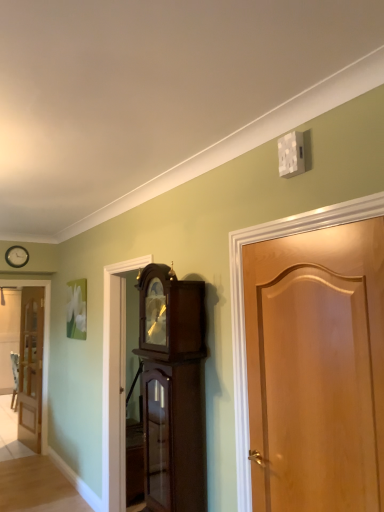
Question: Does light brown wooden door at left, the 2th door positioned from the right, have a smaller size compared to dark wood grandfather clock at center?

Choices:
 (A) no
 (B) yes

Answer: (B)

Question: Does light brown wooden door at left, placed as the 1th door when sorted from back to front, lie behind dark wood grandfather clock at center?

Choices:
 (A) no
 (B) yes

Answer: (B)

Question: Does light brown wooden door at left, placed as the 1th door when sorted from back to front, have a larger size compared to dark wood grandfather clock at center?

Choices:
 (A) no
 (B) yes

Answer: (A)

Question: Is dark wood grandfather clock at center located within light brown wooden door at left, the 2th door positioned from the right?

Choices:
 (A) no
 (B) yes

Answer: (A)

Question: Is light brown wooden door at left, the 2th door positioned from the right, positioned with its back to dark wood grandfather clock at center?

Choices:
 (A) no
 (B) yes

Answer: (A)

Question: Is light brown wooden door at left, the first door positioned from the left, taller than dark wood grandfather clock at center?

Choices:
 (A) yes
 (B) no

Answer: (A)

Question: Is light brown wood door at right, the 1th door when ordered from front to back, wider than matte black clock at upper left?

Choices:
 (A) yes
 (B) no

Answer: (A)

Question: Is light brown wood door at right, the 1th door when ordered from front to back, behind matte black clock at upper left?

Choices:
 (A) no
 (B) yes

Answer: (A)

Question: From the image's perspective, is light brown wood door at right, which is the 1th door in right-to-left order, above matte black clock at upper left?

Choices:
 (A) yes
 (B) no

Answer: (B)

Question: Are light brown wood door at right, the 1th door when ordered from front to back, and matte black clock at upper left beside each other?

Choices:
 (A) yes
 (B) no

Answer: (B)

Question: Is light brown wood door at right, the second door viewed from the left, at the right side of matte black clock at upper left?

Choices:
 (A) no
 (B) yes

Answer: (B)

Question: From a real-world perspective, does light brown wood door at right, which is the 1th door in right-to-left order, sit lower than matte black clock at upper left?

Choices:
 (A) yes
 (B) no

Answer: (A)

Question: Can you confirm if matte black clock at upper left is wider than dark wood grandfather clock at center?

Choices:
 (A) no
 (B) yes

Answer: (A)